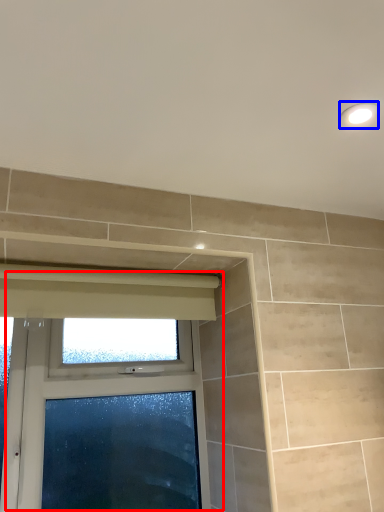
Question: Which object is closer to the camera taking this photo, window (highlighted by a red box) or light fixture (highlighted by a blue box)?

Choices:
 (A) window
 (B) light fixture

Answer: (B)